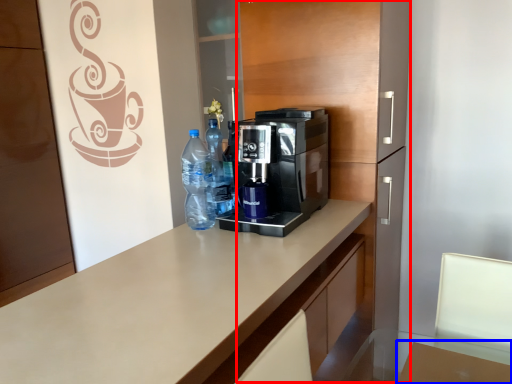
Question: Among these objects, which one is nearest to the camera, dresser (highlighted by a red box) or table (highlighted by a blue box)?

Choices:
 (A) dresser
 (B) table

Answer: (B)